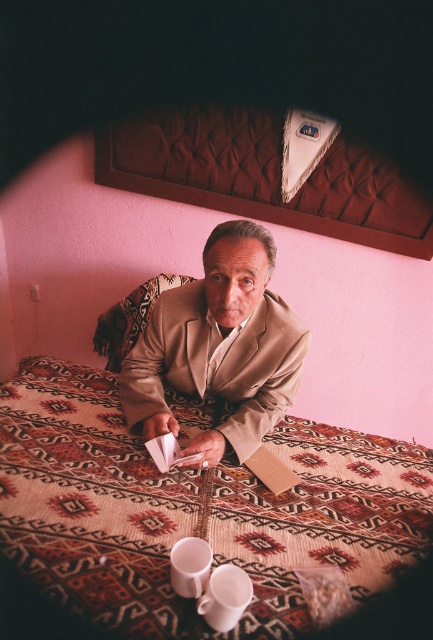
Does patterned fabric bed at center have a larger size compared to white matte cup at lower center?

Yes, patterned fabric bed at center is bigger than white matte cup at lower center.

From the picture: Who is shorter, patterned fabric bed at center or white matte cup at lower center?

Standing shorter between the two is white matte cup at lower center.

Identify the location of patterned fabric bed at center. The image size is (433, 640). (191, 509).

Is beige fabric suit at center closer to camera compared to white glossy cup at lower center?

No, it is not.

Is beige fabric suit at center below white glossy cup at lower center?

Actually, beige fabric suit at center is above white glossy cup at lower center.

You are a GUI agent. You are given a task and a screenshot of the screen. Output one action in this format:
    pyautogui.click(x=<x>, y=<y>)
    Task: Click on the beige fabric suit at center
    The height and width of the screenshot is (640, 433).
    Given the screenshot: What is the action you would take?
    pyautogui.click(x=219, y=348)

Does patterned fabric bed at center appear under beige fabric suit at center?

Yes, patterned fabric bed at center is below beige fabric suit at center.

Who is lower down, patterned fabric bed at center or beige fabric suit at center?

Positioned lower is patterned fabric bed at center.

Identify the location of patterned fabric bed at center. (191, 509).